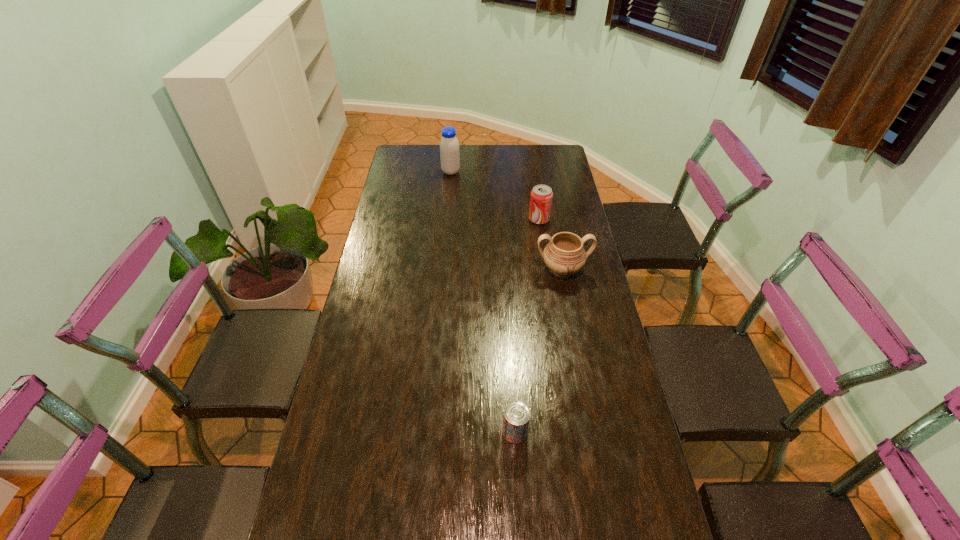
Identify the location of free area in between the urn and the third object from right to left. click(x=539, y=351).

This screenshot has width=960, height=540. I want to click on empty space between the shortest object and the soya milk, so click(x=483, y=302).

Where is `vacant point located between the soda can and the nearest object`? The height and width of the screenshot is (540, 960). vacant point located between the soda can and the nearest object is located at coordinates (527, 326).

The width and height of the screenshot is (960, 540). In order to click on free spot between the third farthest object and the beer can in this screenshot , I will do `click(539, 351)`.

Locate which object ranks third in proximity to the urn. Please provide its 2D coordinates. Your answer should be formatted as a tuple, i.e. [(x, y)], where the tuple contains the x and y coordinates of a point satisfying the conditions above.

[(449, 146)]

This screenshot has height=540, width=960. Identify the location of the second closest object relative to the urn. (516, 419).

Image resolution: width=960 pixels, height=540 pixels. I want to click on vacant space that satisfies the following two spatial constraints: 1. on the back side of the beer can; 2. on the right side of the soda can, so click(x=502, y=219).

Locate an element on the screen. vacant space that satisfies the following two spatial constraints: 1. on the front side of the leftmost object; 2. on the left side of the third object from right to left is located at coordinates (428, 432).